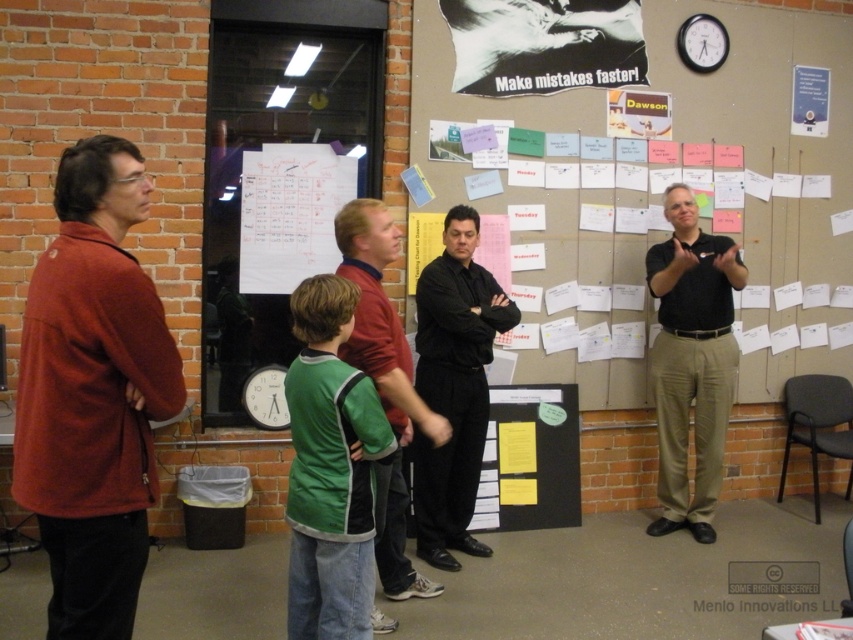
Which is more to the right, black smooth shirt at right or white paperboard at center?

From the viewer's perspective, black smooth shirt at right appears more on the right side.

Is black smooth shirt at right positioned behind white paperboard at center?

That is False.

At what (x,y) coordinates should I click in order to perform the action: click on black smooth shirt at right. Please return your answer as a coordinate pair (x, y). This screenshot has height=640, width=853. Looking at the image, I should click on pyautogui.click(x=691, y=360).

The height and width of the screenshot is (640, 853). Find the location of `black smooth shirt at right`. black smooth shirt at right is located at coordinates (691, 360).

Can you confirm if green jersey at center is positioned above matte blue poster at upper right?

No.

Does green jersey at center appear on the left side of matte blue poster at upper right?

Correct, you'll find green jersey at center to the left of matte blue poster at upper right.

At what (x,y) coordinates should I click in order to perform the action: click on green jersey at center. Please return your answer as a coordinate pair (x, y). Looking at the image, I should click on (329, 468).

Between black smooth shirt at right and green fabric shirt at center, which one has more height?

black smooth shirt at right is taller.

The image size is (853, 640). What are the coordinates of `black smooth shirt at right` in the screenshot? It's located at (691, 360).

Where is `black smooth shirt at right`? This screenshot has width=853, height=640. black smooth shirt at right is located at coordinates (691, 360).